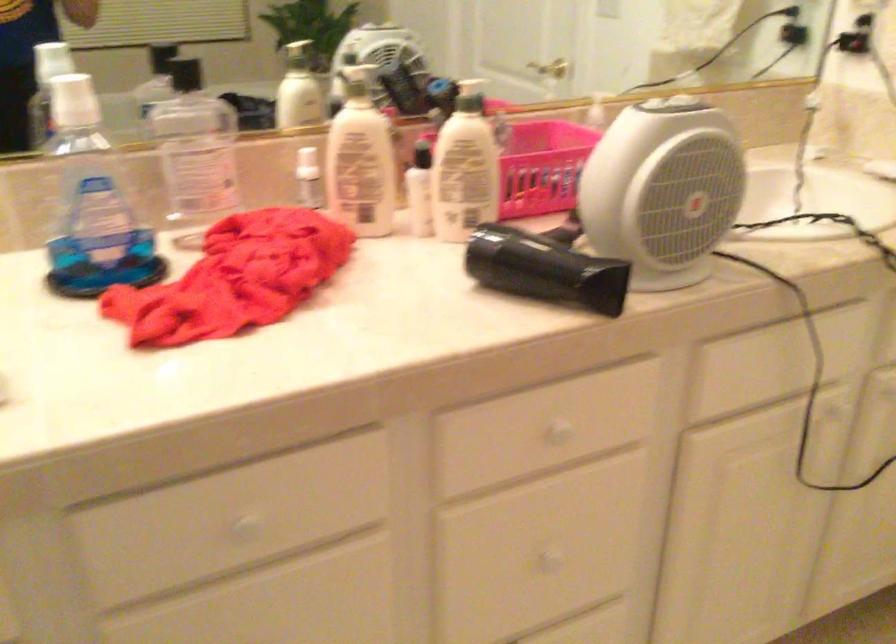
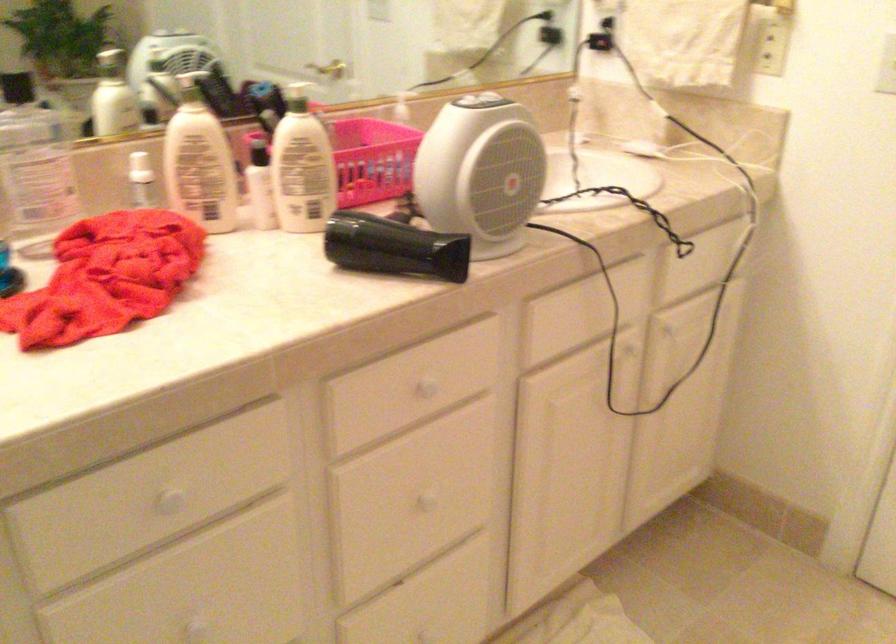
Find the pixel in the second image that matches point (291, 89) in the first image.

(113, 97)